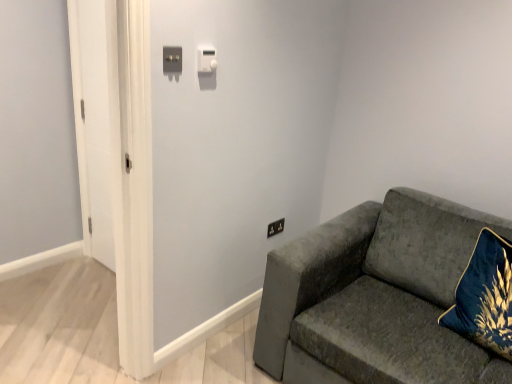
Question: Considering the relative sizes of satin silver switch at upper center, which is the second light switch in back-to-front order, and white glossy door at left in the image provided, is satin silver switch at upper center, which is the second light switch in back-to-front order, smaller than white glossy door at left?

Choices:
 (A) yes
 (B) no

Answer: (A)

Question: Can we say satin silver switch at upper center, which appears as the 2th light switch when viewed from the right, lies outside white glossy door at left?

Choices:
 (A) yes
 (B) no

Answer: (A)

Question: Considering the relative sizes of satin silver switch at upper center, which appears as the 2th light switch when viewed from the right, and white glossy door at left in the image provided, is satin silver switch at upper center, which appears as the 2th light switch when viewed from the right, wider than white glossy door at left?

Choices:
 (A) no
 (B) yes

Answer: (A)

Question: Is satin silver switch at upper center, the 1th light switch positioned from the left, next to white glossy door at left and touching it?

Choices:
 (A) yes
 (B) no

Answer: (B)

Question: Does satin silver switch at upper center, the 1th light switch positioned from the left, have a lesser width compared to white glossy door at left?

Choices:
 (A) no
 (B) yes

Answer: (B)

Question: From the image's perspective, is satin silver switch at upper center, which appears as the 2th light switch when viewed from the right, over white glossy door at left?

Choices:
 (A) yes
 (B) no

Answer: (A)

Question: Does velvet gray couch at right have a lesser height compared to black plastic electrical outlet at upper right?

Choices:
 (A) yes
 (B) no

Answer: (B)

Question: Is velvet gray couch at right facing away from black plastic electrical outlet at upper right?

Choices:
 (A) yes
 (B) no

Answer: (B)

Question: Are velvet gray couch at right and black plastic electrical outlet at upper right located far from each other?

Choices:
 (A) yes
 (B) no

Answer: (B)

Question: Is velvet gray couch at right to the right of black plastic electrical outlet at upper right from the viewer's perspective?

Choices:
 (A) no
 (B) yes

Answer: (B)

Question: From a real-world perspective, is velvet gray couch at right below black plastic electrical outlet at upper right?

Choices:
 (A) yes
 (B) no

Answer: (A)

Question: Does velvet gray couch at right lie behind black plastic electrical outlet at upper right?

Choices:
 (A) yes
 (B) no

Answer: (B)

Question: From a real-world perspective, is white glossy door at left under satin silver switch at upper center, which appears as the 2th light switch when viewed from the right?

Choices:
 (A) no
 (B) yes

Answer: (B)